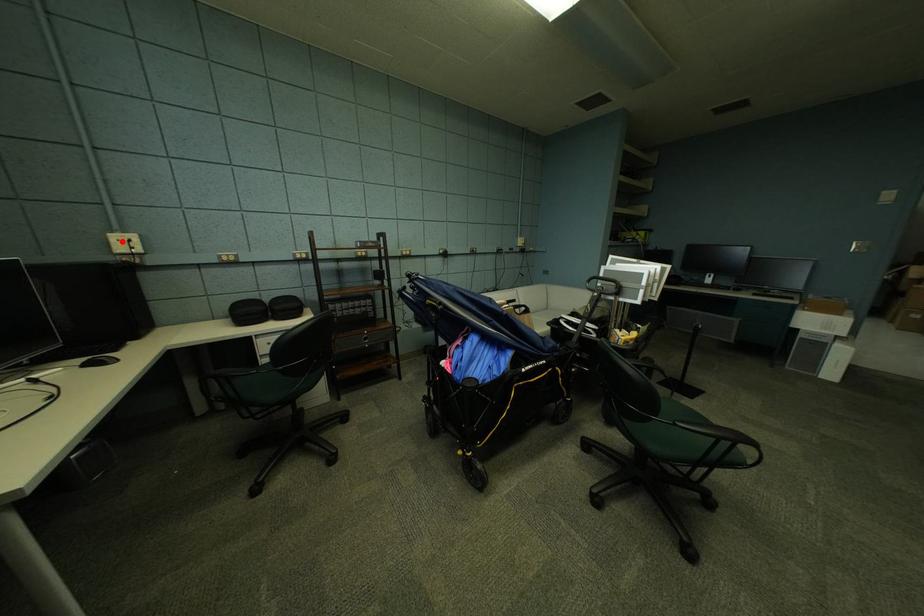
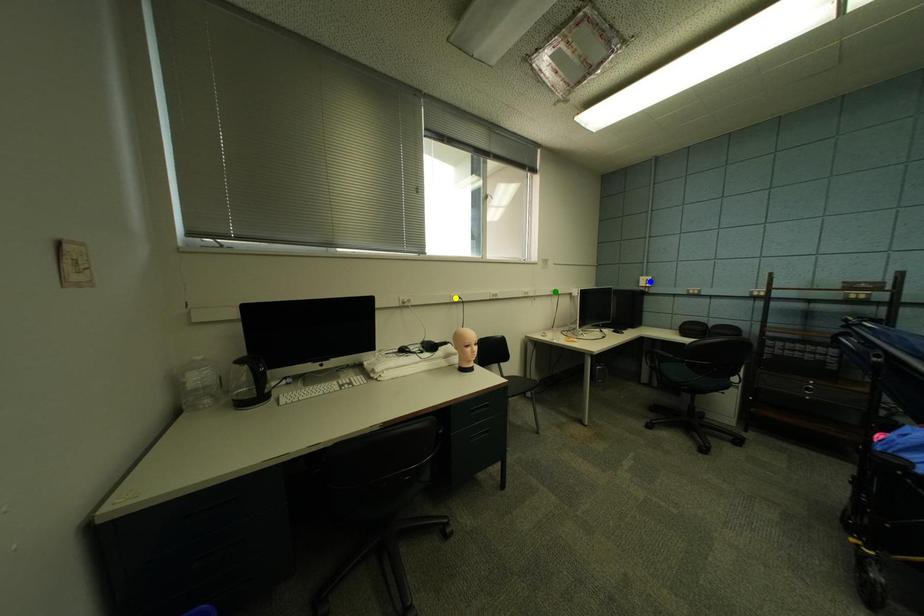
Question: I am providing you with two images of the same scene from different viewpoints. A red point is marked on the first image. You are given multiple points on the second image. Which mark in image 2 goes with the point in image 1?

Choices:
 (A) yellow point
 (B) green point
 (C) blue point

Answer: (C)